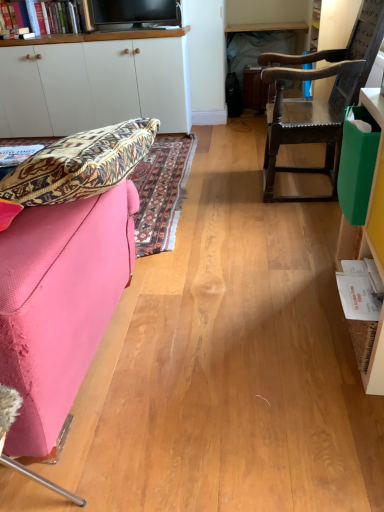
Question: From the image's perspective, is green plastic bag at right, the 2th cabinetry when ordered from left to right, above or below pink fabric couch at left?

Choices:
 (A) below
 (B) above

Answer: (B)

Question: Is green plastic bag at right, marked as the 2th cabinetry in a top-to-bottom arrangement, wider or thinner than pink fabric couch at left?

Choices:
 (A) wide
 (B) thin

Answer: (B)

Question: Estimate the real-world distances between objects in this image. Which object is closer to the matte paper book at left, marked as the first book in a top-to-bottom arrangement?

Choices:
 (A) green plastic bag at right, the 1th cabinetry in the front-to-back sequence
 (B) pink fabric couch at left
 (C) white matte cabinet at upper left, the second cabinetry when ordered from front to back
 (D) white paper book at right, which is the first book in bottom-to-top order
 (E) black glossy tv at upper center

Answer: (B)

Question: Estimate the real-world distances between objects in this image. Which object is farther from the dark brown wooden chair at right?

Choices:
 (A) black glossy tv at upper center
 (B) green plastic bag at right, marked as the 2th cabinetry in a top-to-bottom arrangement
 (C) matte paper book at left, which appears as the second book when viewed from the front
 (D) white paper book at right, which appears as the 2th book when viewed from the back
 (E) white matte cabinet at upper left, the 2th cabinetry in the bottom-to-top sequence

Answer: (E)